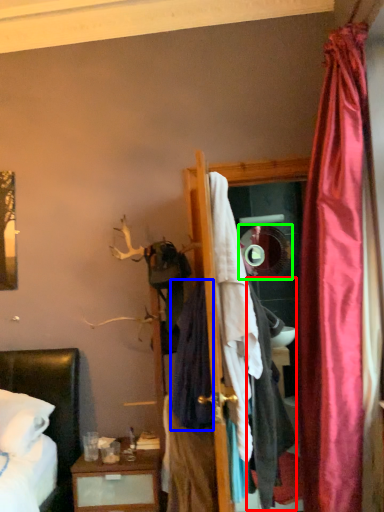
Question: Estimate the real-world distances between objects in this image. Which object is farther from clothing (highlighted by a red box), clothing (highlighted by a blue box) or mirror (highlighted by a green box)?

Choices:
 (A) clothing
 (B) mirror

Answer: (B)